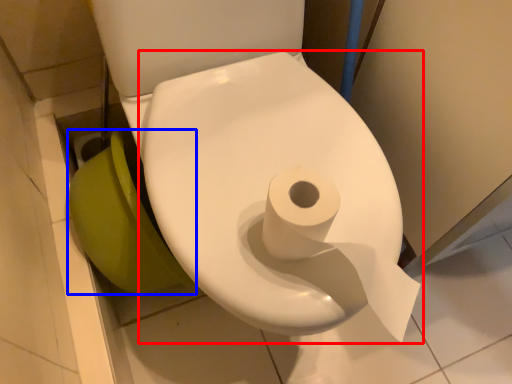
Question: Which object is further to the camera taking this photo, toilet (highlighted by a red box) or toilet bowl (highlighted by a blue box)?

Choices:
 (A) toilet
 (B) toilet bowl

Answer: (B)